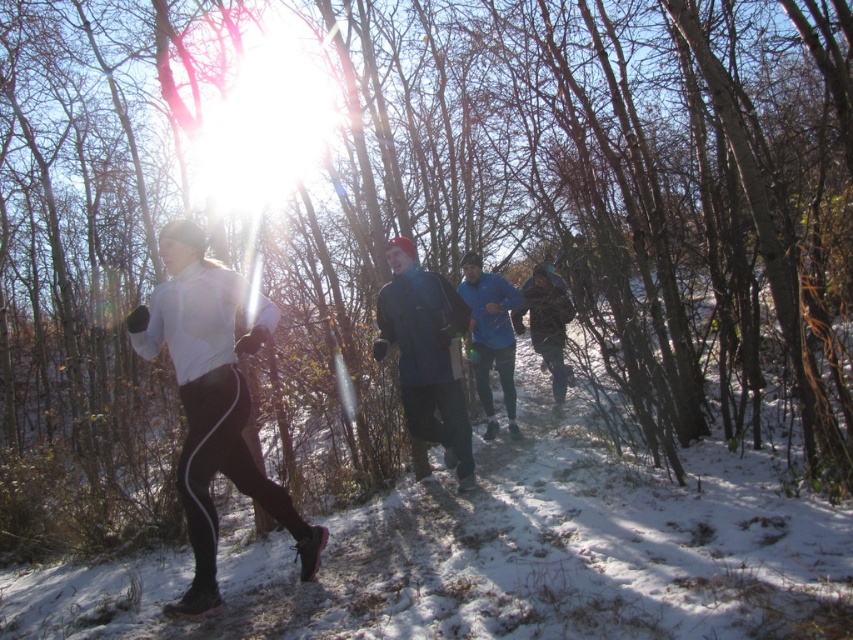
Is blue fabric jacket at center to the left of camouflage jacket at center from the viewer's perspective?

Indeed, blue fabric jacket at center is positioned on the left side of camouflage jacket at center.

Between blue fabric jacket at center and camouflage jacket at center, which one appears on the left side from the viewer's perspective?

blue fabric jacket at center is more to the left.

Measure the distance between point (434, 284) and camera.

Point (434, 284) is 5.39 meters away from camera.

The height and width of the screenshot is (640, 853). I want to click on blue fabric jacket at center, so click(425, 355).

Which is behind, point (218, 596) or point (431, 394)?

The point (431, 394) is more distant.

Find the location of a particular element. This screenshot has height=640, width=853. white matte running suit at center is located at coordinates (212, 401).

Who is more distant from viewer, [194,307] or [448,291]?

Positioned behind is point [448,291].

Where is `white matte running suit at center`? white matte running suit at center is located at coordinates (212, 401).

Between blue fleece jacket at center and camouflage jacket at center, which one has more height?

blue fleece jacket at center

Is point (473, 353) behind point (554, 310)?

Yes, it is behind point (554, 310).

Which is behind, point (509, 433) or point (560, 342)?

Positioned behind is point (509, 433).

The width and height of the screenshot is (853, 640). In order to click on blue fleece jacket at center in this screenshot , I will do `click(490, 337)`.